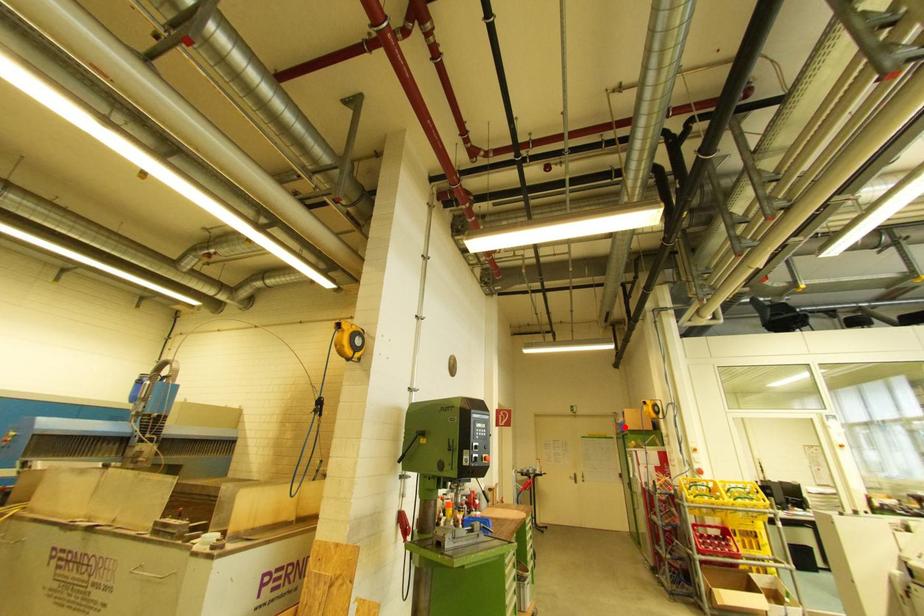
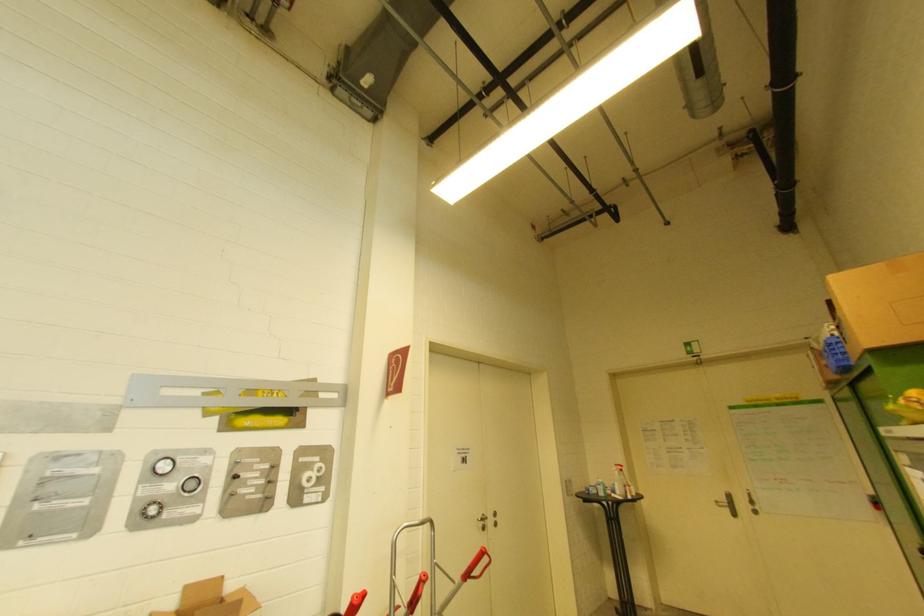
Question: A red point is marked in image1. In image2, is the corresponding 3D point closer to the camera or farther? Reply with the corresponding letter.

Choices:
 (A) The corresponding 3D point is closer.
 (B) The corresponding 3D point is farther.

Answer: (A)